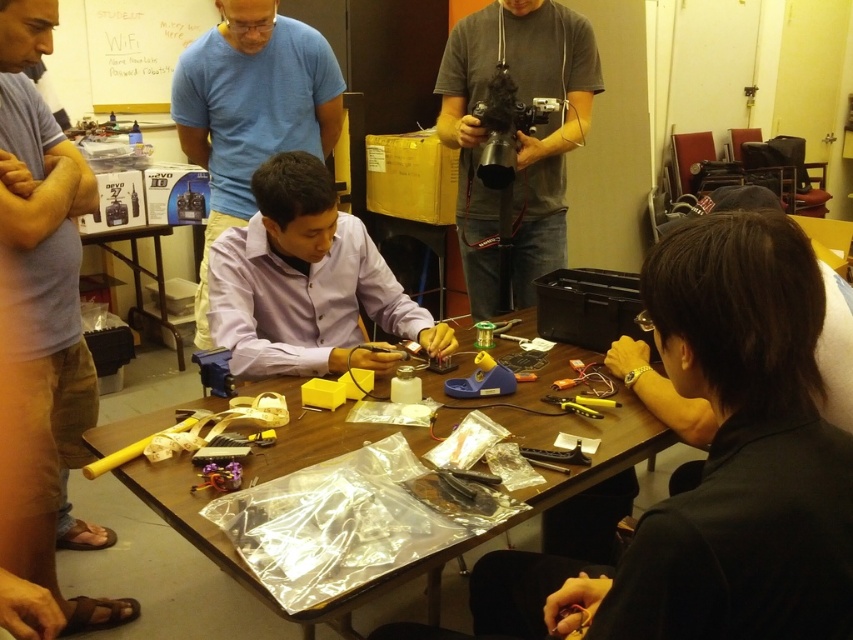
Who is more forward, (308, 225) or (479, 365)?

Point (479, 365)

Between matte purple shirt at center and blue plastic glue gun at center, which one is positioned lower?

blue plastic glue gun at center is below.

Between point (254, 241) and point (471, 378), which one is positioned in front?

Point (471, 378) is in front.

You are a GUI agent. You are given a task and a screenshot of the screen. Output one action in this format:
    pyautogui.click(x=<x>, y=<y>)
    Task: Click on the matte purple shirt at center
    The width and height of the screenshot is (853, 640).
    Given the screenshot: What is the action you would take?
    pyautogui.click(x=306, y=282)

Between gray matte camera at upper center and blue plastic glue gun at center, which one has more height?

Standing taller between the two is gray matte camera at upper center.

Is gray matte camera at upper center smaller than blue plastic glue gun at center?

No, gray matte camera at upper center is not smaller than blue plastic glue gun at center.

Between point (572, 100) and point (457, 387), which one is positioned in front?

Point (457, 387) is in front.

Where is `gray matte camera at upper center`? gray matte camera at upper center is located at coordinates (515, 138).

Which is below, gray matte camera at upper center or black plastic table at lower left?

black plastic table at lower left is below.

Is gray matte camera at upper center bigger than black plastic table at lower left?

Actually, gray matte camera at upper center might be smaller than black plastic table at lower left.

Is point (532, 20) in front of point (123, 253)?

Yes, point (532, 20) is in front of point (123, 253).

Where is `gray matte camera at upper center`? This screenshot has width=853, height=640. gray matte camera at upper center is located at coordinates (515, 138).